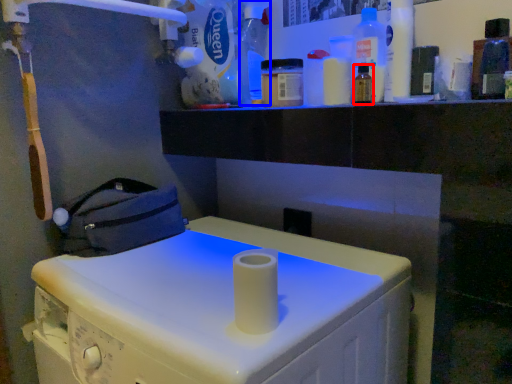
Question: Which object appears farthest to the camera in this image, bottle (highlighted by a red box) or bottle (highlighted by a blue box)?

Choices:
 (A) bottle
 (B) bottle

Answer: (B)